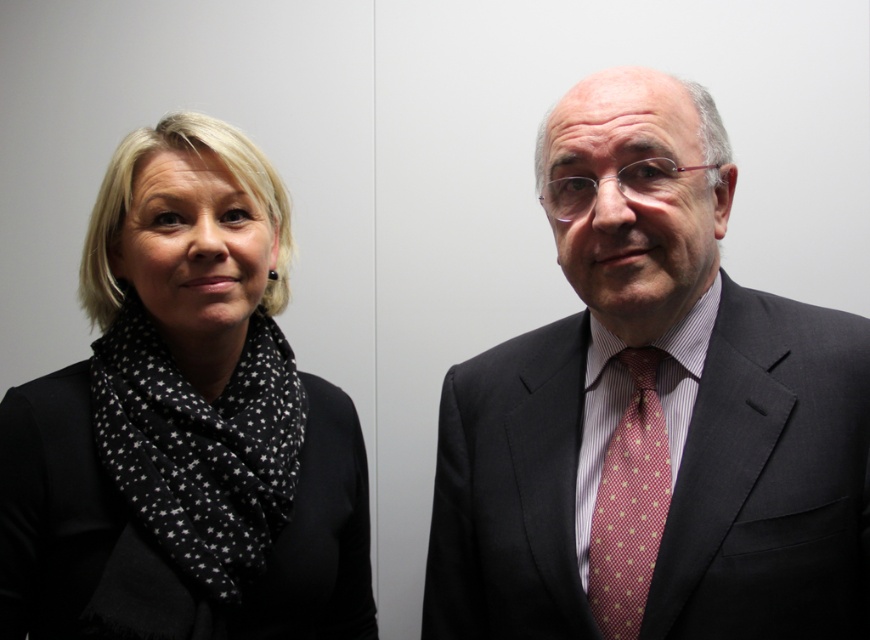
Does dark gray suit at right lie behind black dotted scarf at left?

No, it is not.

What do you see at coordinates (652, 413) in the screenshot? Image resolution: width=870 pixels, height=640 pixels. I see `dark gray suit at right` at bounding box center [652, 413].

Between point (647, 458) and point (128, 212), which one is positioned in front?

Positioned in front is point (647, 458).

Locate an element on the screen. This screenshot has width=870, height=640. dark gray suit at right is located at coordinates (652, 413).

Does point (474, 480) lie behind point (619, 611)?

Yes, point (474, 480) is behind point (619, 611).

Locate an element on the screen. This screenshot has height=640, width=870. dark gray suit at right is located at coordinates (652, 413).

Can you confirm if black dotted scarf at left is positioned above pink dotted fabric tie at center?

Yes, black dotted scarf at left is above pink dotted fabric tie at center.

Image resolution: width=870 pixels, height=640 pixels. What are the coordinates of `black dotted scarf at left` in the screenshot? It's located at (184, 424).